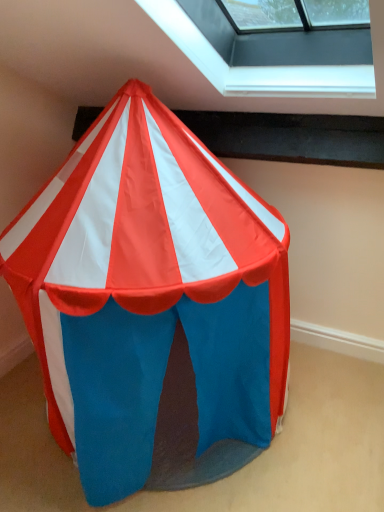
I want to click on transparent glass window at upper center, so click(257, 68).

This screenshot has width=384, height=512. What do you see at coordinates (257, 68) in the screenshot? I see `transparent glass window at upper center` at bounding box center [257, 68].

Measure the distance between point [347,72] and camera.

Point [347,72] and camera are 4.43 feet apart.

Find the location of a particular element. Image resolution: width=384 pixels, height=512 pixels. transparent glass window at upper center is located at coordinates (257, 68).